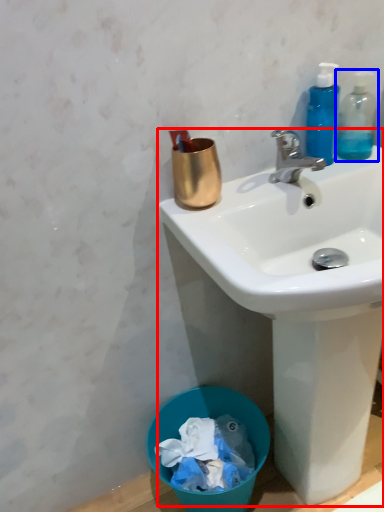
Question: Which of the following is the farthest to the observer, sink (highlighted by a red box) or bottle (highlighted by a blue box)?

Choices:
 (A) sink
 (B) bottle

Answer: (B)